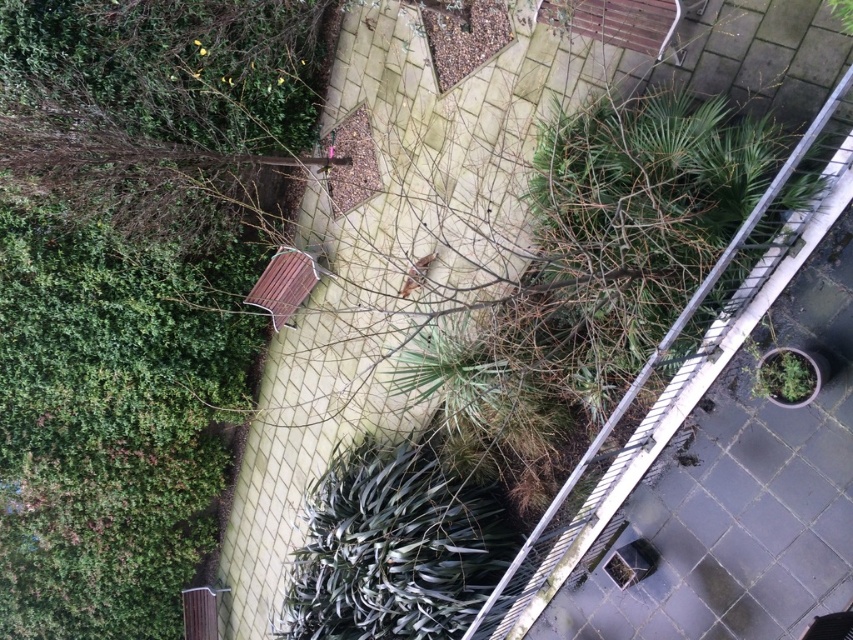
Does point (283, 268) lie in front of point (775, 400)?

No, it is not.

Is wooden bench at center positioned before green matte pot at right?

No.

Between point (277, 273) and point (779, 364), which one is positioned in front?

Positioned in front is point (779, 364).

Where is `wooden bench at center`? wooden bench at center is located at coordinates (283, 284).